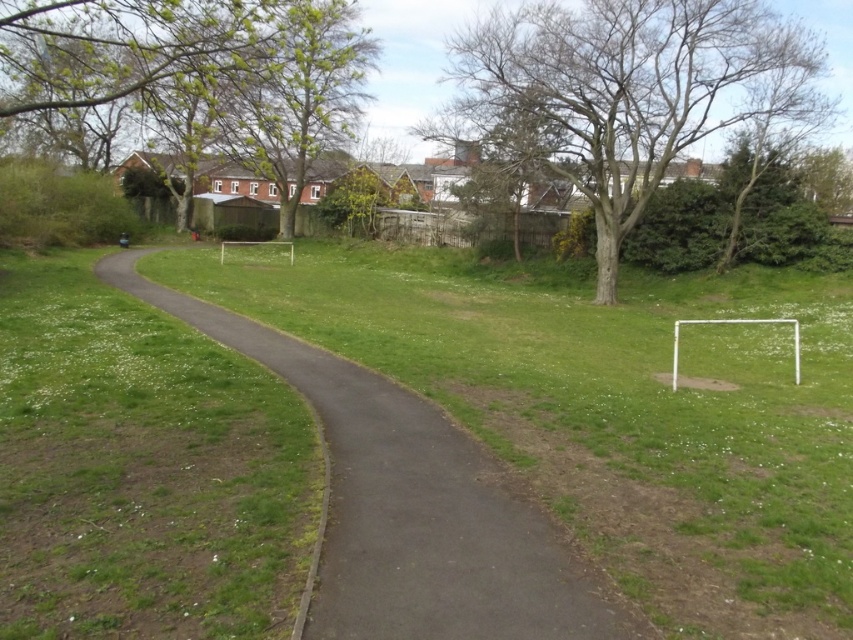
Question: Which object is closer to the camera taking this photo?

Choices:
 (A) green leafy tree at upper left
 (B) bare wood tree at upper center

Answer: (A)

Question: Is dark gray asphalt at center positioned at the back of green leafy tree at upper left?

Choices:
 (A) no
 (B) yes

Answer: (A)

Question: Is dark gray asphalt at center smaller than green leafy tree at upper left?

Choices:
 (A) yes
 (B) no

Answer: (A)

Question: Does dark gray asphalt at center have a greater width compared to bare wood tree at upper center?

Choices:
 (A) no
 (B) yes

Answer: (A)

Question: Which of the following is the closest to the observer?

Choices:
 (A) 369,461
 (B) 640,144

Answer: (A)

Question: Among these objects, which one is nearest to the camera?

Choices:
 (A) dark gray asphalt at center
 (B) green leafy tree at upper left

Answer: (A)